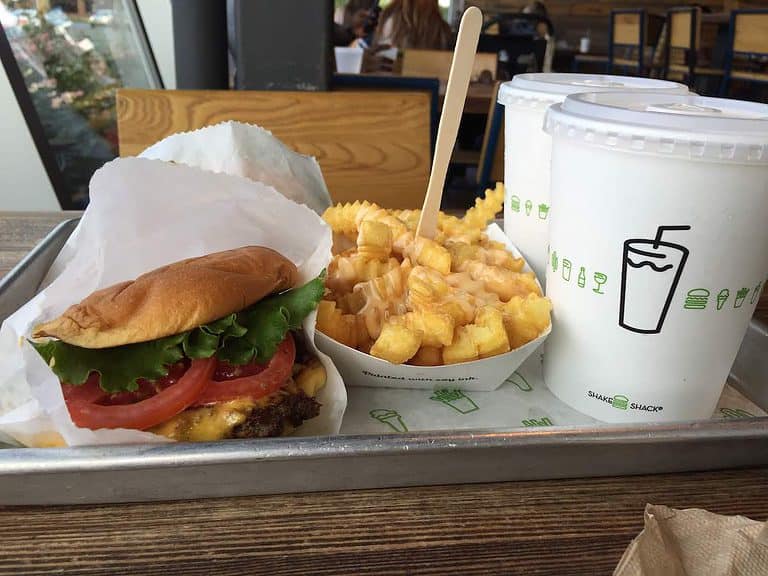
Locate an element on the screen. Image resolution: width=768 pixels, height=576 pixels. napkin is located at coordinates pos(660,528).